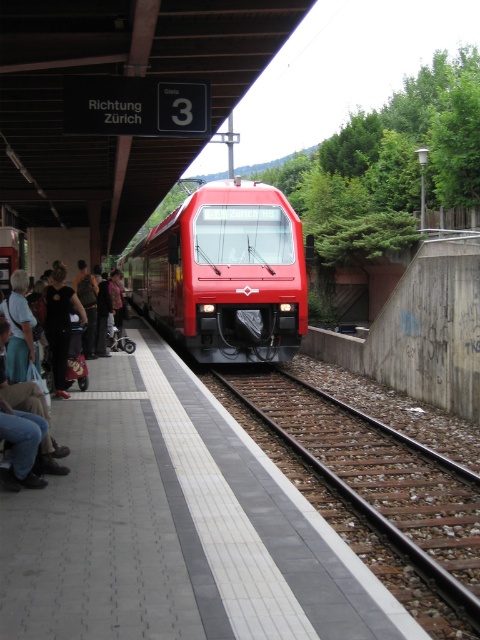
Which is above, rusty metal track at center or dark gray fabric jacket at left?

dark gray fabric jacket at left is above.

Consider the image. Can you confirm if rusty metal track at center is taller than dark gray fabric jacket at left?

Incorrect, rusty metal track at center's height is not larger of dark gray fabric jacket at left's.

Describe the element at coordinates (374, 497) in the screenshot. I see `rusty metal track at center` at that location.

Where is `rusty metal track at center`? Image resolution: width=480 pixels, height=640 pixels. rusty metal track at center is located at coordinates tap(374, 497).

Which of these two, shiny red train at center or dark gray fabric jacket at left, stands taller?

shiny red train at center is taller.

Does shiny red train at center appear on the left side of dark gray fabric jacket at left?

Indeed, shiny red train at center is positioned on the left side of dark gray fabric jacket at left.

Between point (257, 288) and point (54, 353), which one is positioned in front?

Positioned in front is point (54, 353).

Locate an element on the screen. shiny red train at center is located at coordinates (x=225, y=273).

From the picture: Who is more forward, [446,609] or [286,276]?

Point [446,609] is more forward.

Is rusty metal track at center smaller than shiny red train at center?

Indeed, rusty metal track at center has a smaller size compared to shiny red train at center.

Which is behind, point (404, 592) or point (203, 346)?

The point (203, 346) is more distant.

Locate an element on the screen. rusty metal track at center is located at coordinates [x=374, y=497].